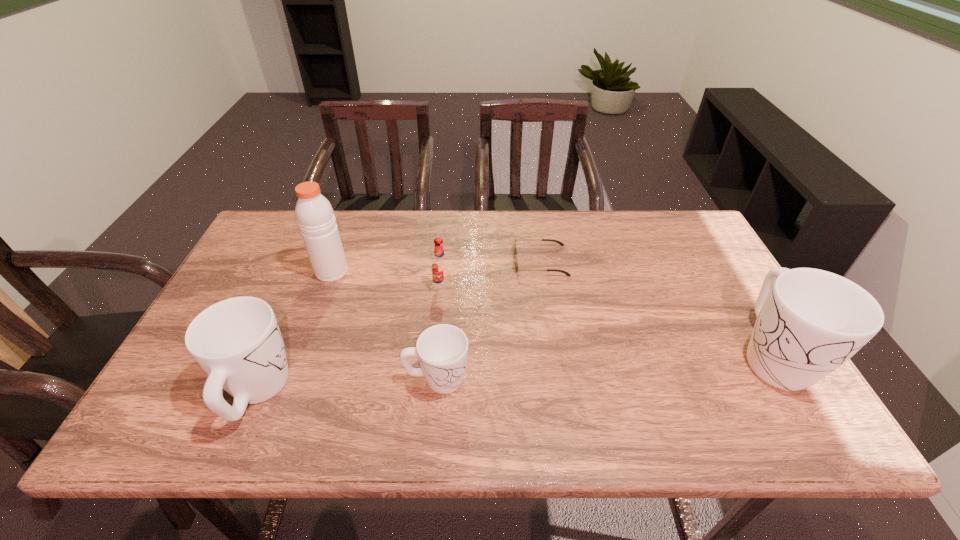
This screenshot has height=540, width=960. In order to click on object at the near left corner in this screenshot , I will do `click(237, 341)`.

Identify the location of object located in the near right corner section of the desktop. The width and height of the screenshot is (960, 540). (809, 322).

Find the location of `vacant space at the far edge of the desktop`. vacant space at the far edge of the desktop is located at coordinates coord(374,251).

Identify the location of free spot at the near edge of the desktop. This screenshot has height=540, width=960. (297, 378).

At what (x,y) coordinates should I click in order to perform the action: click on vacant area at the left edge. Please return your answer as a coordinate pair (x, y). Looking at the image, I should click on (241, 278).

Locate an element on the screen. vacant position at the right edge of the desktop is located at coordinates (704, 324).

I want to click on blank space at the far right corner of the desktop, so click(x=684, y=253).

You are a GUI agent. You are given a task and a screenshot of the screen. Output one action in this format:
    pyautogui.click(x=<x>, y=<y>)
    Task: Click on the free space between the shortest mug and the leftmost mug
    The image size is (960, 540).
    Given the screenshot: What is the action you would take?
    [x=347, y=386]

Image resolution: width=960 pixels, height=540 pixels. I want to click on free spot between the shaker and the fifth tallest object, so (384, 326).

This screenshot has width=960, height=540. I want to click on free point between the leftmost mug and the rightmost mug, so (x=514, y=374).